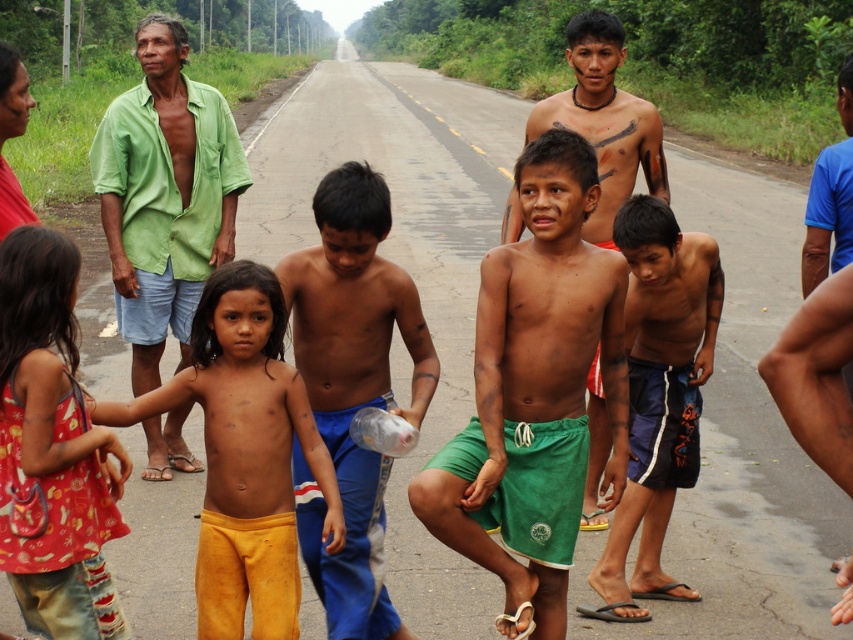
You are a photographer trying to capture a group photo of the red printed dress at center and the shiny skin boy at center. Which object should you focus on first if you want to include both in the frame without cropping?

The red printed dress at center occupies less space than the shiny skin boy at center, so you should focus on the shiny skin boy at center first to ensure it fits within the frame.

You are a traveler who needs to determine which item is bigger between the green cotton shorts at center and the shiny plastic bottle at center. Which one is larger?

The green cotton shorts at center is larger in size than the shiny plastic bottle at center.